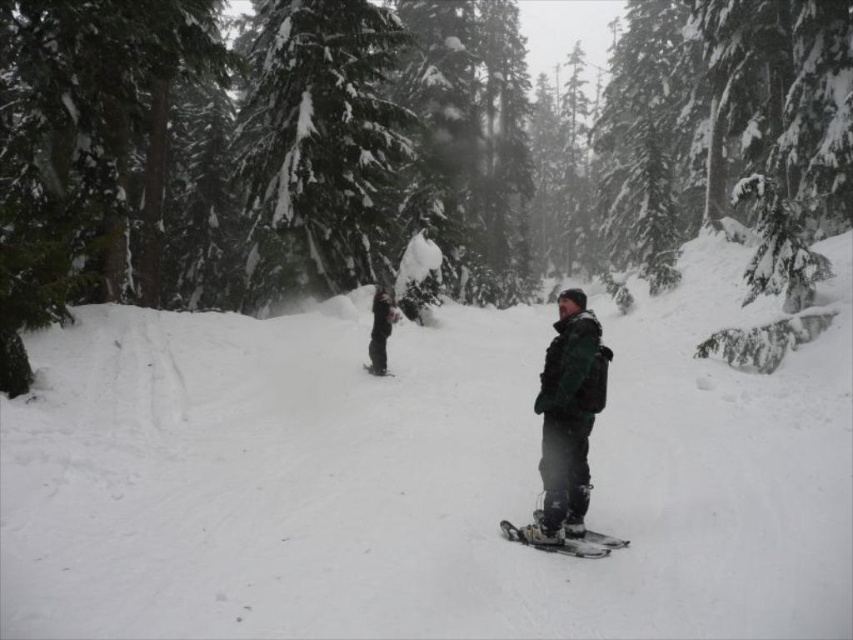
You are planning to take a photo of the snowy forest scene. The white fluffy snow at center and the dark gray snowsuit at center are in your frame. Which object is closer to the camera?

The white fluffy snow at center is positioned under dark gray snowsuit at center, meaning the dark gray snowsuit at center is closer to the camera since it is above the snow.

You are standing at the center of the snowy forest scene. There is a point marked at coordinates (397, 150). What object is located at that point?

The point at coordinates (397, 150) indicates a snow covered evergreen tree at center.